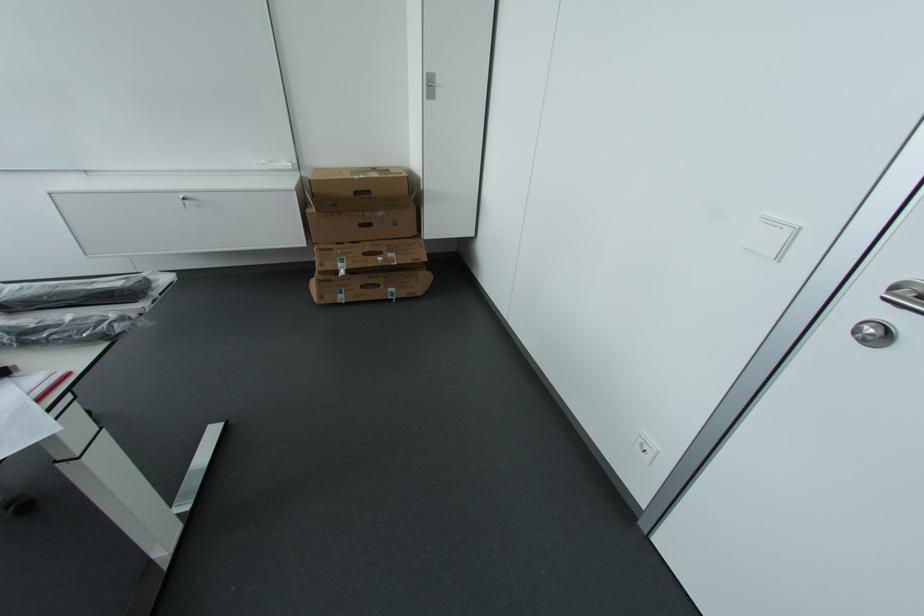
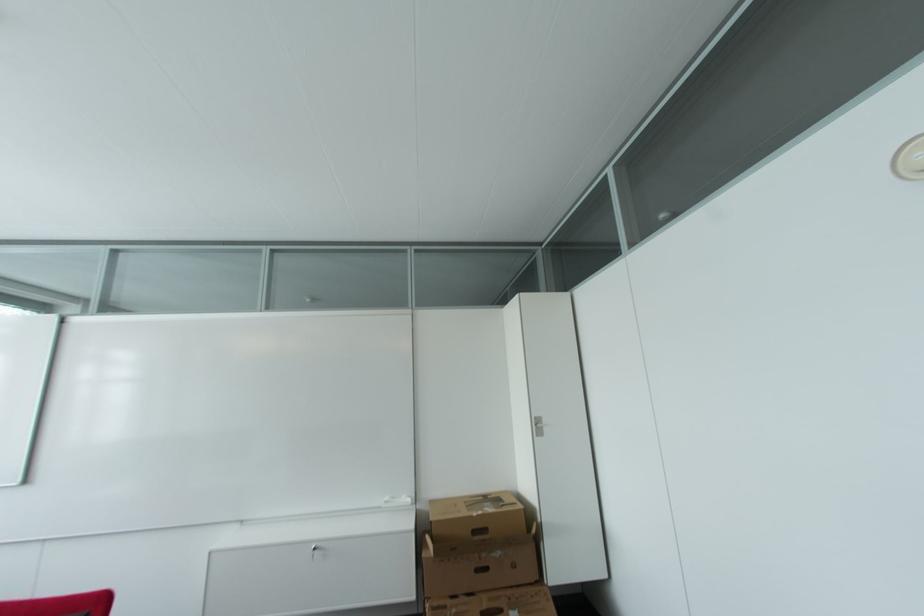
Where in the second image is the point corresponding to point (334, 251) from the first image?

(448, 609)